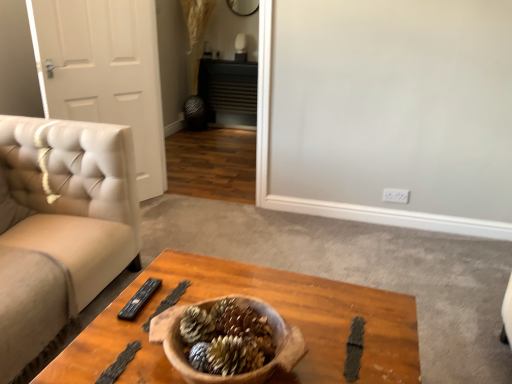
Question: Would you say white leather door at left is to the left or to the right of black plastic remote at center in the picture?

Choices:
 (A) right
 (B) left

Answer: (B)

Question: From the image's perspective, relative to black plastic remote at center, is white leather door at left above or below?

Choices:
 (A) below
 (B) above

Answer: (B)

Question: Based on their relative distances, which object is farther from the wooden coffee table at center?

Choices:
 (A) black plastic remote at center
 (B) white leather door at left

Answer: (B)

Question: Which of these objects is positioned farthest from the black plastic remote at center?

Choices:
 (A) white leather door at left
 (B) wooden coffee table at center

Answer: (A)